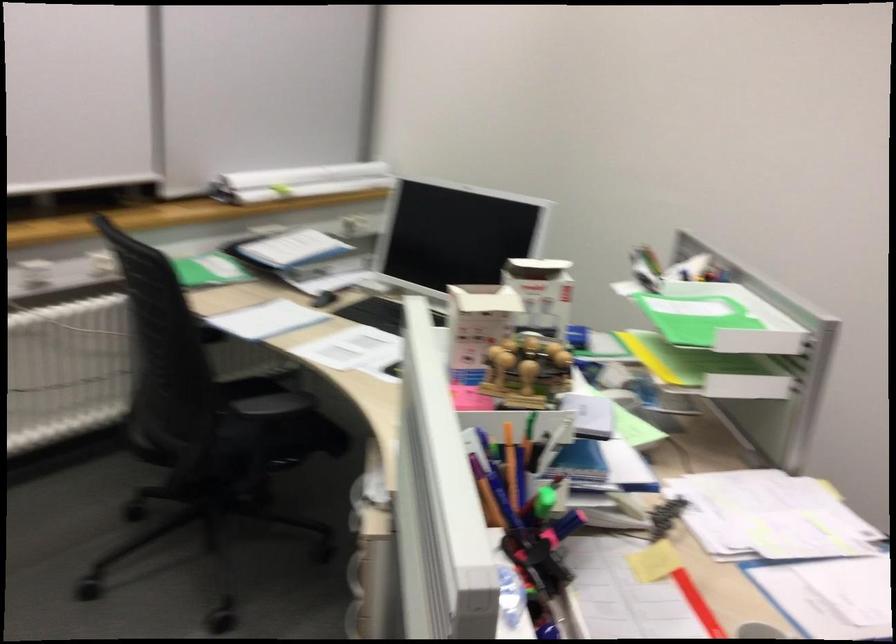
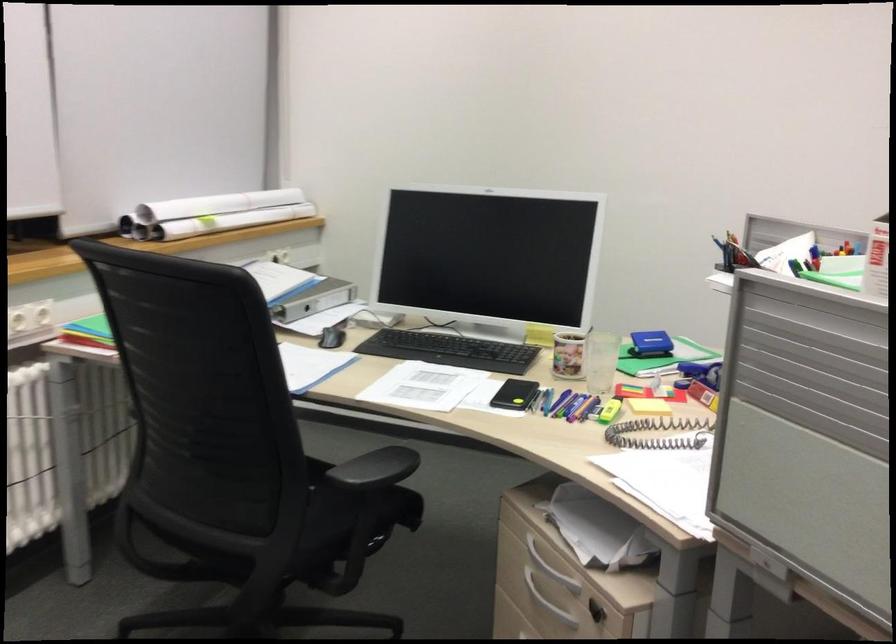
Find the pixel in the second image that matches (x=566, y=342) in the first image.

(650, 344)